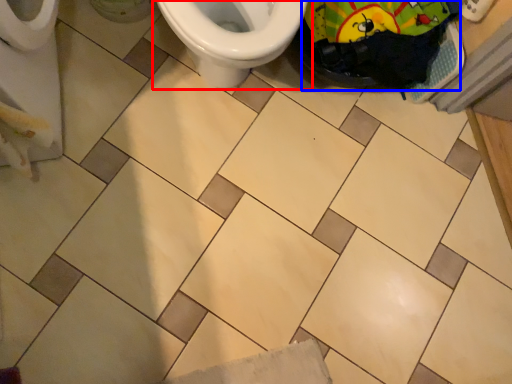
Question: Which of the following is the closest to the observer, toilet (highlighted by a red box) or material (highlighted by a blue box)?

Choices:
 (A) toilet
 (B) material

Answer: (A)